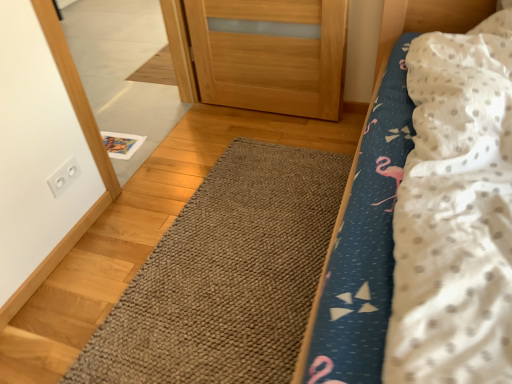
Question: Is brown textured rug at center wider than white glossy mirror at upper left?

Choices:
 (A) yes
 (B) no

Answer: (A)

Question: From the image's perspective, is brown textured rug at center under white glossy mirror at upper left?

Choices:
 (A) no
 (B) yes

Answer: (B)

Question: Does brown textured rug at center come behind white glossy mirror at upper left?

Choices:
 (A) no
 (B) yes

Answer: (A)

Question: Can we say brown textured rug at center lies outside white glossy mirror at upper left?

Choices:
 (A) no
 (B) yes

Answer: (B)

Question: From the image's perspective, is brown textured rug at center above white glossy mirror at upper left?

Choices:
 (A) yes
 (B) no

Answer: (B)

Question: Based on their sizes in the image, would you say white plastic outlet at upper left is bigger or smaller than brown textured rug at center?

Choices:
 (A) small
 (B) big

Answer: (A)

Question: Is point (57, 185) closer or farther from the camera than point (214, 173)?

Choices:
 (A) farther
 (B) closer

Answer: (B)

Question: Would you say white plastic outlet at upper left is to the left or to the right of brown textured rug at center in the picture?

Choices:
 (A) left
 (B) right

Answer: (A)

Question: From a real-world perspective, is white plastic outlet at upper left above or below brown textured rug at center?

Choices:
 (A) above
 (B) below

Answer: (A)

Question: Is brown textured rug at center wider or thinner than white glossy mirror at upper left?

Choices:
 (A) thin
 (B) wide

Answer: (B)

Question: From the image's perspective, is brown textured rug at center located above or below white glossy mirror at upper left?

Choices:
 (A) below
 (B) above

Answer: (A)

Question: Considering the positions of point (290, 215) and point (96, 67), is point (290, 215) closer or farther from the camera than point (96, 67)?

Choices:
 (A) farther
 (B) closer

Answer: (B)

Question: From a real-world perspective, relative to white glossy mirror at upper left, is brown textured rug at center vertically above or below?

Choices:
 (A) above
 (B) below

Answer: (B)

Question: In the image, is white plastic outlet at upper left on the left side or the right side of fluffy fabric bed at center?

Choices:
 (A) left
 (B) right

Answer: (A)

Question: Considering the positions of point (58, 168) and point (337, 377), is point (58, 168) closer or farther from the camera than point (337, 377)?

Choices:
 (A) closer
 (B) farther

Answer: (B)